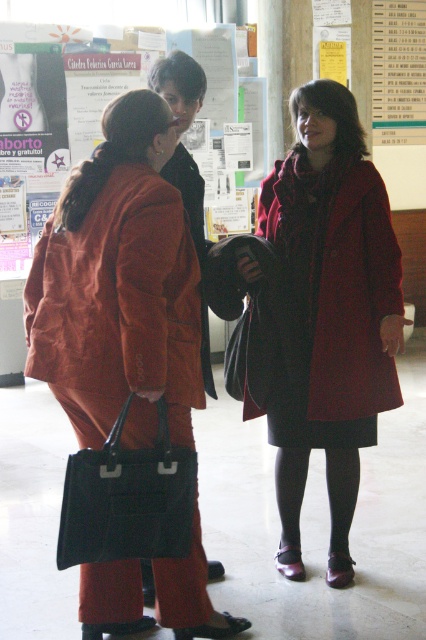
Question: Can you confirm if matte orange coat at left is positioned to the left of matte black poster at upper center?

Choices:
 (A) yes
 (B) no

Answer: (B)

Question: Among these points, which one is nearest to the camera?

Choices:
 (A) (405, 122)
 (B) (161, 218)

Answer: (B)

Question: Which object appears closest to the camera in this image?

Choices:
 (A) matte orange coat at left
 (B) white paper at upper right
 (C) matte black poster at upper center

Answer: (A)

Question: From the image, what is the correct spatial relationship of matte red coat at center in relation to white paper at upper right?

Choices:
 (A) below
 (B) above

Answer: (A)

Question: Is matte black poster at upper center in front of matte red coat at center?

Choices:
 (A) no
 (B) yes

Answer: (A)

Question: Which point appears farthest from the camera in this image?

Choices:
 (A) (417, 93)
 (B) (391, 250)
 (C) (103, 221)
 (D) (190, 262)

Answer: (A)